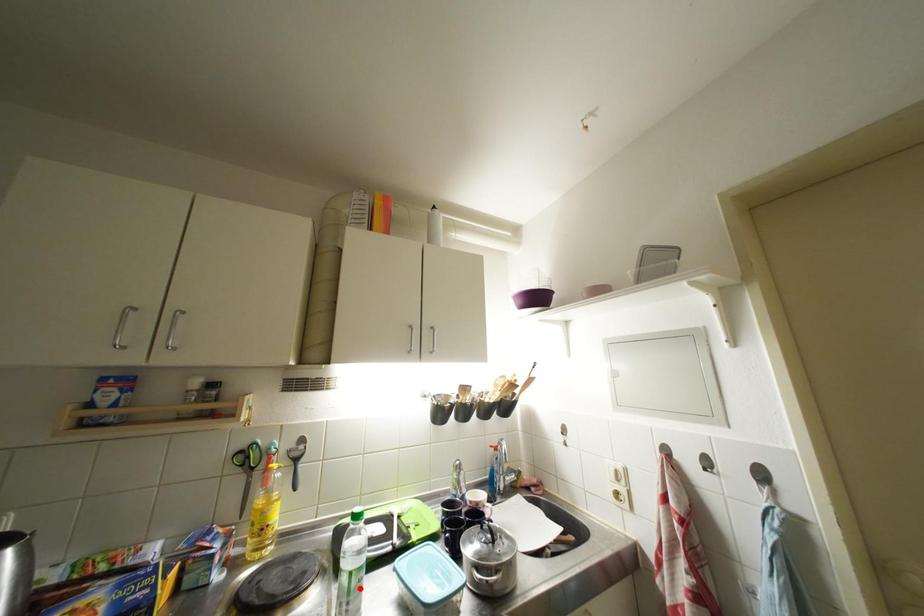
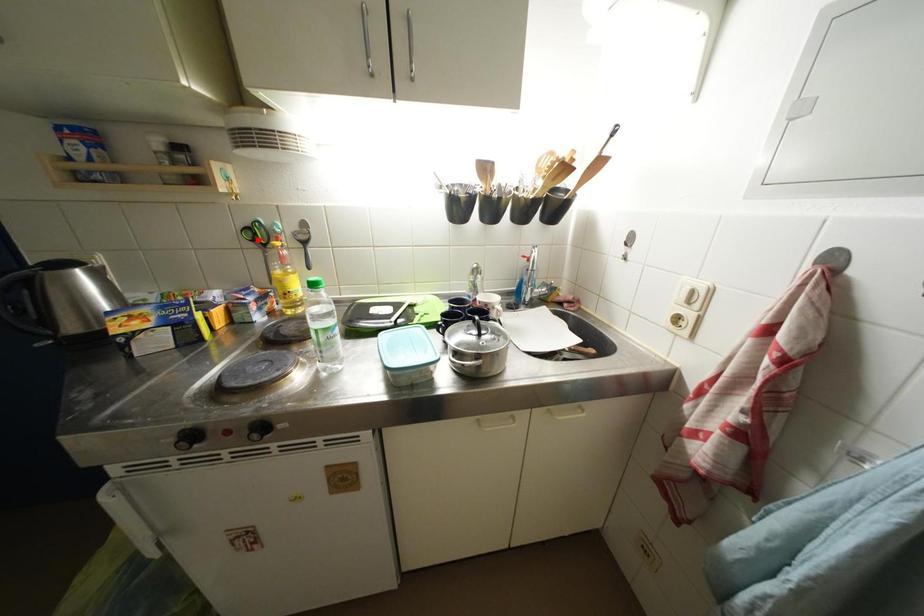
I am providing you with two images of the same scene from different viewpoints. A red point is marked on the first image and another point is marked on the second image. Is the marked point in image1 the same physical position as the marked point in image2?

No